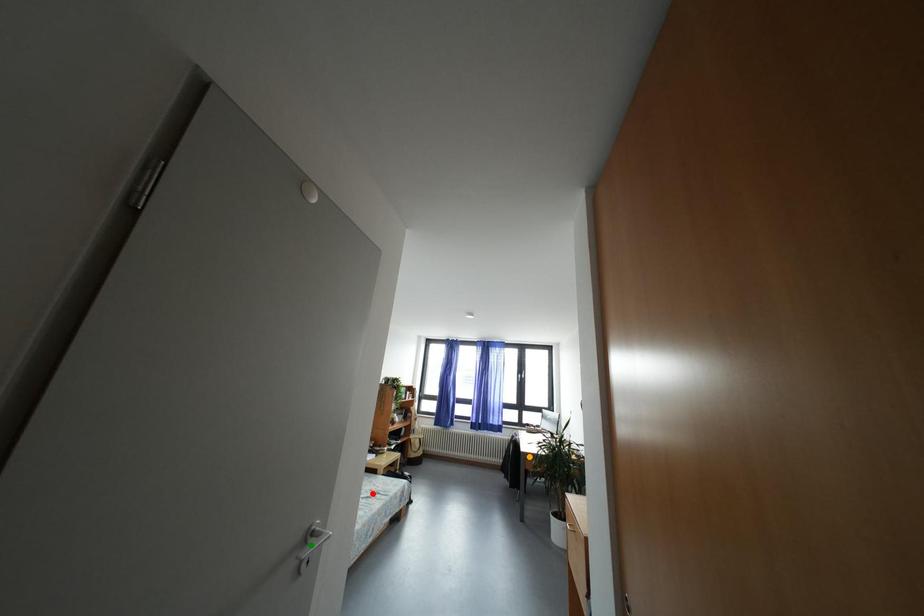
Order these from nearest to farthest:
orange point
green point
red point

green point < red point < orange point